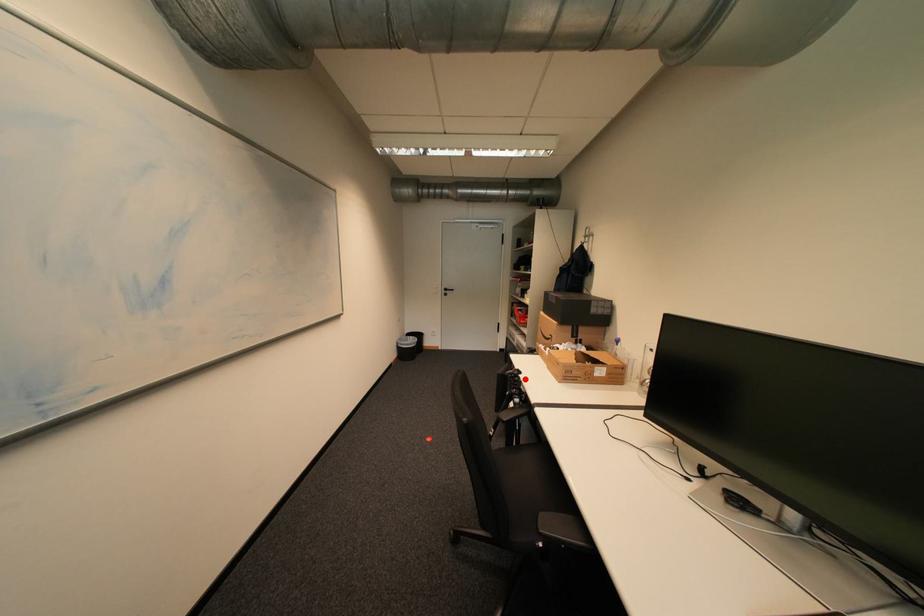
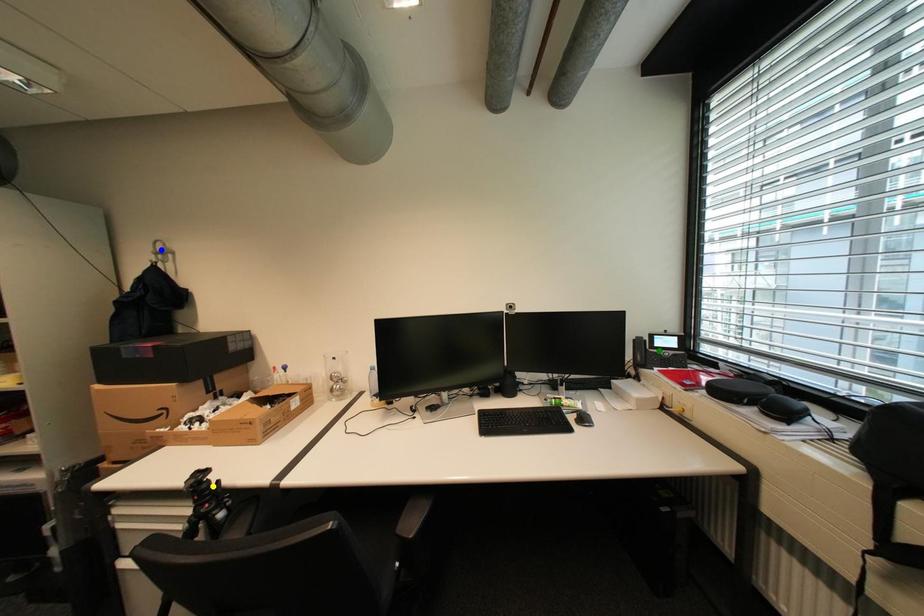
Question: I am providing you with two images of the same scene from different viewpoints. A red point is marked on the first image. You are given multiple points on the second image. Which spot in image 2 lines up with the point in image 1?

Choices:
 (A) green point
 (B) blue point
 (C) yellow point

Answer: (C)